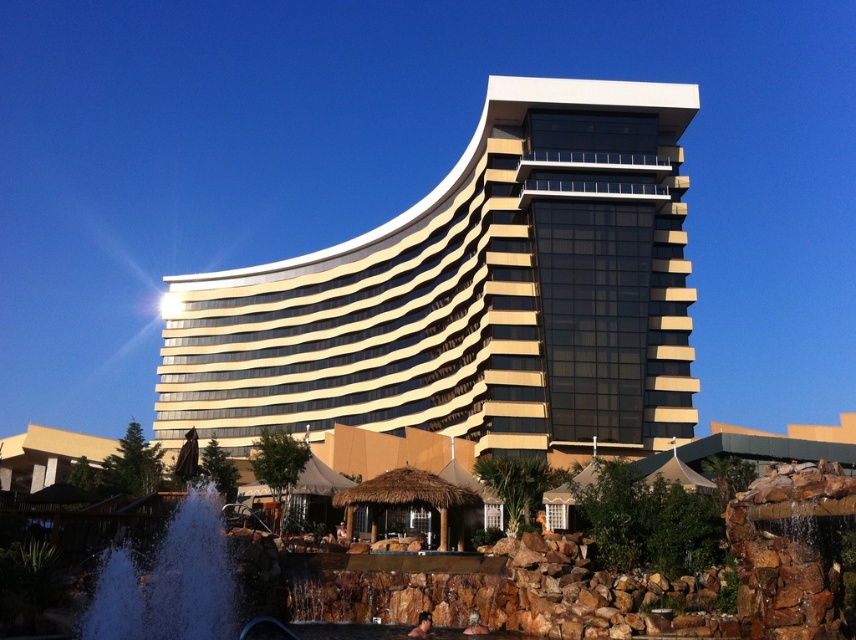
Is gold glass building at center shorter than white frothy water at lower left?

Incorrect, gold glass building at center's height does not fall short of white frothy water at lower left's.

Is point (538, 118) more distant than point (211, 593)?

Yes, point (538, 118) is behind point (211, 593).

This screenshot has height=640, width=856. In order to click on gold glass building at center in this screenshot , I will do `click(471, 300)`.